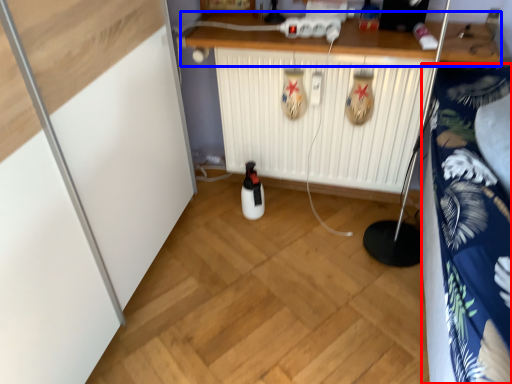
Question: Which of the following is the closest to the observer, bedding (highlighted by a red box) or counter (highlighted by a blue box)?

Choices:
 (A) bedding
 (B) counter

Answer: (A)